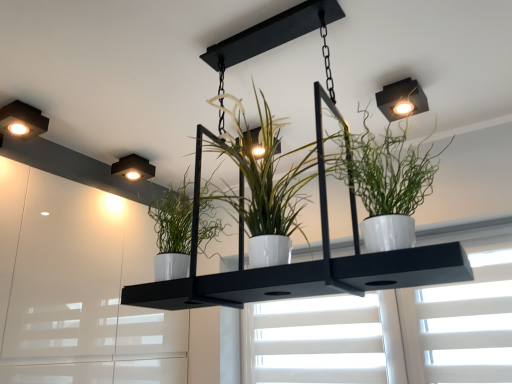
Question: From a real-world perspective, is matte black square light at upper left, positioned as the 2th lamp in right-to-left order, positioned over matte black square light fixture at upper left, acting as the 2th lamp starting from the top, based on gravity?

Choices:
 (A) no
 (B) yes

Answer: (A)

Question: Is matte black square light at upper left, arranged as the 2th lamp when ordered from the bottom, outside matte black square light fixture at upper left, the 1th lamp from the bottom?

Choices:
 (A) yes
 (B) no

Answer: (A)

Question: Is matte black square light at upper left, which appears as the second lamp when viewed from the back, oriented towards matte black square light fixture at upper left, which is counted as the second lamp, starting from the left?

Choices:
 (A) yes
 (B) no

Answer: (B)

Question: Is matte black square light at upper left, positioned as the 2th lamp in right-to-left order, shorter than matte black square light fixture at upper left, which appears as the first lamp when viewed from the back?

Choices:
 (A) yes
 (B) no

Answer: (B)

Question: Does matte black square light at upper left, arranged as the 2th lamp when ordered from the bottom, have a smaller size compared to matte black square light fixture at upper left, which appears as the 2th lamp when viewed from the front?

Choices:
 (A) no
 (B) yes

Answer: (A)

Question: Is matte black square light at upper left, arranged as the 2th lamp when ordered from the bottom, at the right side of matte black square light fixture at upper left, the 1th lamp from the bottom?

Choices:
 (A) no
 (B) yes

Answer: (A)

Question: From the image's perspective, would you say matte black square light at upper right is shown under matte black square light fixture at upper left, acting as the 2th lamp starting from the top?

Choices:
 (A) no
 (B) yes

Answer: (A)

Question: From the image's perspective, is matte black square light at upper right located above matte black square light fixture at upper left, which appears as the first lamp when viewed from the right?

Choices:
 (A) no
 (B) yes

Answer: (B)

Question: From a real-world perspective, is matte black square light at upper right physically below matte black square light fixture at upper left, acting as the 2th lamp starting from the top?

Choices:
 (A) no
 (B) yes

Answer: (B)

Question: Is matte black square light at upper right facing away from matte black square light fixture at upper left, which is counted as the second lamp, starting from the left?

Choices:
 (A) no
 (B) yes

Answer: (A)

Question: From a real-world perspective, is matte black square light at upper right positioned over matte black square light fixture at upper left, which appears as the first lamp when viewed from the back, based on gravity?

Choices:
 (A) no
 (B) yes

Answer: (A)

Question: Is matte black square light fixture at upper left, which appears as the 2th lamp when viewed from the front, a part of matte black square light at upper right?

Choices:
 (A) no
 (B) yes

Answer: (A)

Question: Considering the relative sizes of white matte window at center and matte black square light at upper right in the image provided, is white matte window at center taller than matte black square light at upper right?

Choices:
 (A) yes
 (B) no

Answer: (A)